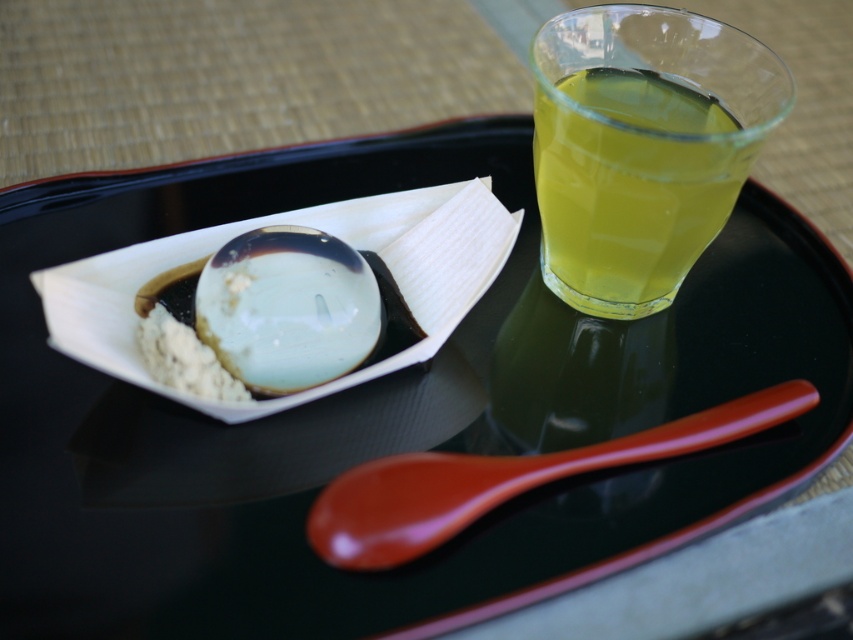
Between translucent glass ball at upper left and glossy plastic spoon at lower center, which one has less height?

Standing shorter between the two is glossy plastic spoon at lower center.

Does point (287, 388) come closer to viewer compared to point (451, 484)?

No, it is not.

Is point (346, 250) positioned before point (415, 452)?

No, (346, 250) is further to viewer.

Where is `translucent glass ball at upper left`? This screenshot has width=853, height=640. translucent glass ball at upper left is located at coordinates (283, 307).

Who is taller, translucent glass cup at upper right or glossy plastic spoon at lower center?

translucent glass cup at upper right

Where is `translucent glass cup at upper right`? translucent glass cup at upper right is located at coordinates (630, 188).

Is translucent glass cup at upper right to the right of translucent glass ball at upper left from the viewer's perspective?

Correct, you'll find translucent glass cup at upper right to the right of translucent glass ball at upper left.

Is translucent glass cup at upper right bigger than translucent glass ball at upper left?

Yes.

Does point (627, 243) come in front of point (375, 353)?

No, it is not.

I want to click on translucent glass cup at upper right, so click(630, 188).